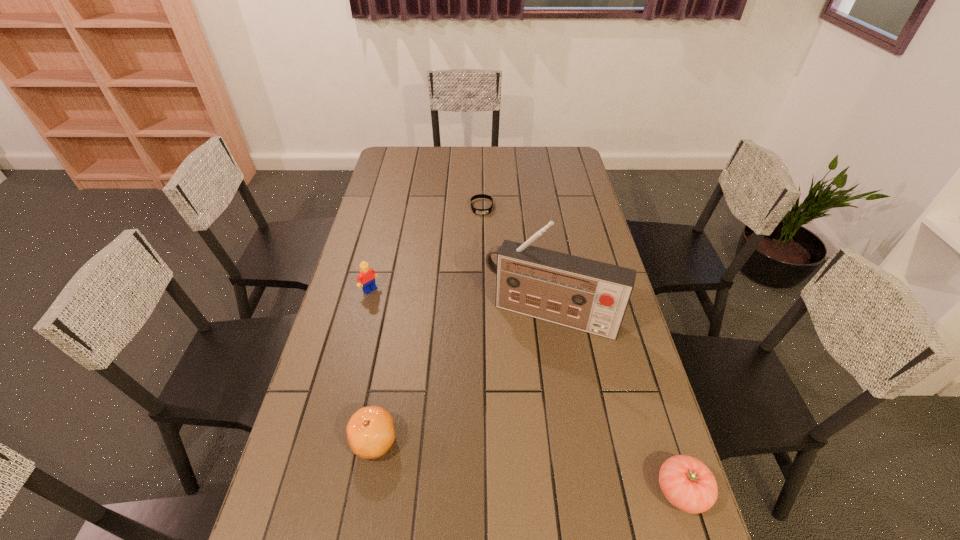
You are a GUI agent. You are given a task and a screenshot of the screen. Output one action in this format:
    pyautogui.click(x=<x>, y=<y>)
    Task: Click on the fourth object from right to left
    
    Given the screenshot: What is the action you would take?
    pyautogui.click(x=370, y=432)

Locate an element on the screen. tomato is located at coordinates (688, 484).

Identify the location of the farthest object. The width and height of the screenshot is (960, 540). (476, 211).

Identify the location of wristband. (476, 211).

Locate an element on the screen. The image size is (960, 540). radio receiver is located at coordinates (592, 296).

Find the location of `the leftmost object`. the leftmost object is located at coordinates (366, 279).

Find the location of a particular element. The image size is (960, 540). the fourth shortest object is located at coordinates (366, 279).

This screenshot has height=540, width=960. What are the coordinates of `vacant space located on the back of the clementine` in the screenshot? It's located at (387, 369).

Where is `vacant area situated 0.340m on the left of the tomato`? The image size is (960, 540). vacant area situated 0.340m on the left of the tomato is located at coordinates (505, 491).

I want to click on vacant space positioned 0.120m on the display of the shortest object, so click(483, 235).